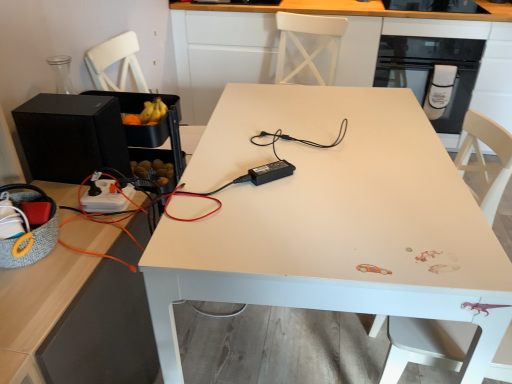
Question: From the image's perspective, is black matte speaker at left, placed as the second appliance when sorted from right to left, above or below white matte table at center?

Choices:
 (A) below
 (B) above

Answer: (B)

Question: In terms of width, does black matte speaker at left, which is the first appliance in back-to-front order, look wider or thinner when compared to white matte table at center?

Choices:
 (A) thin
 (B) wide

Answer: (A)

Question: Estimate the real-world distances between objects in this image. Which object is farther from the black glass door at upper right?

Choices:
 (A) white matte table at center
 (B) white matte table at center
 (C) white wood swivel chair at lower right
 (D) black plastic power adapter at center, the 2th appliance viewed from the back
 (E) black matte speaker at left, arranged as the 2th appliance when viewed from the front

Answer: (E)

Question: Which object is positioned closest to the black matte speaker at left, which ranks as the first appliance in left-to-right order?

Choices:
 (A) white matte table at center
 (B) black glass door at upper right
 (C) white wood swivel chair at lower right
 (D) black plastic power adapter at center, positioned as the first appliance in front-to-back order
 (E) white matte table at center

Answer: (A)